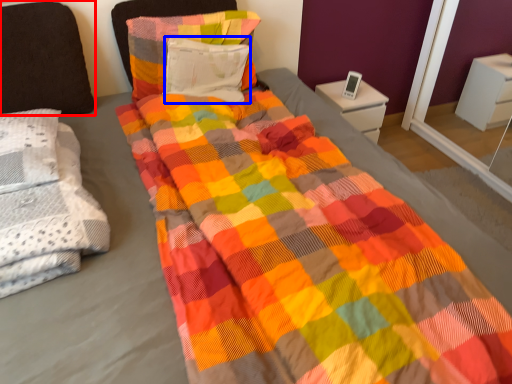
Question: Which object appears closest to the camera in this image, pillow (highlighted by a red box) or pillow (highlighted by a blue box)?

Choices:
 (A) pillow
 (B) pillow

Answer: (A)